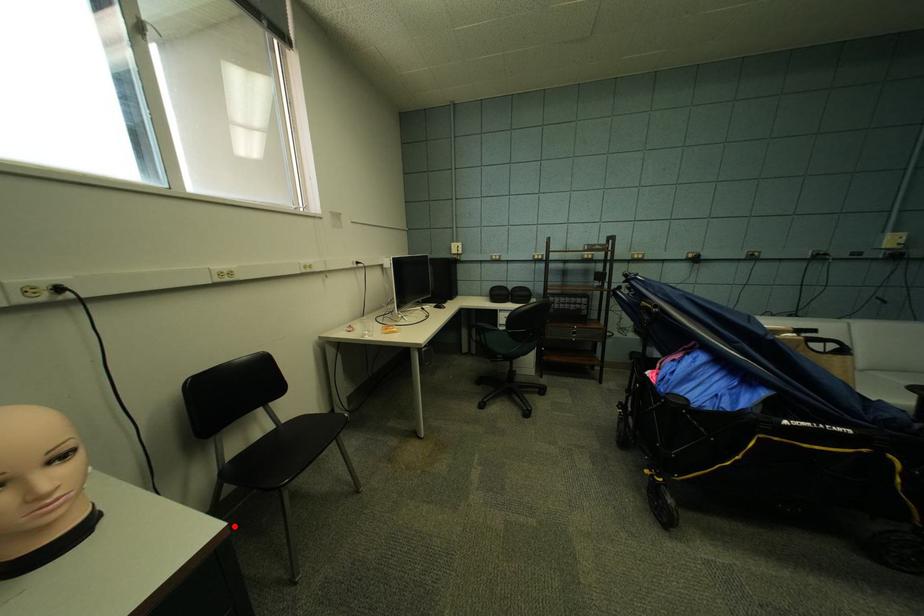
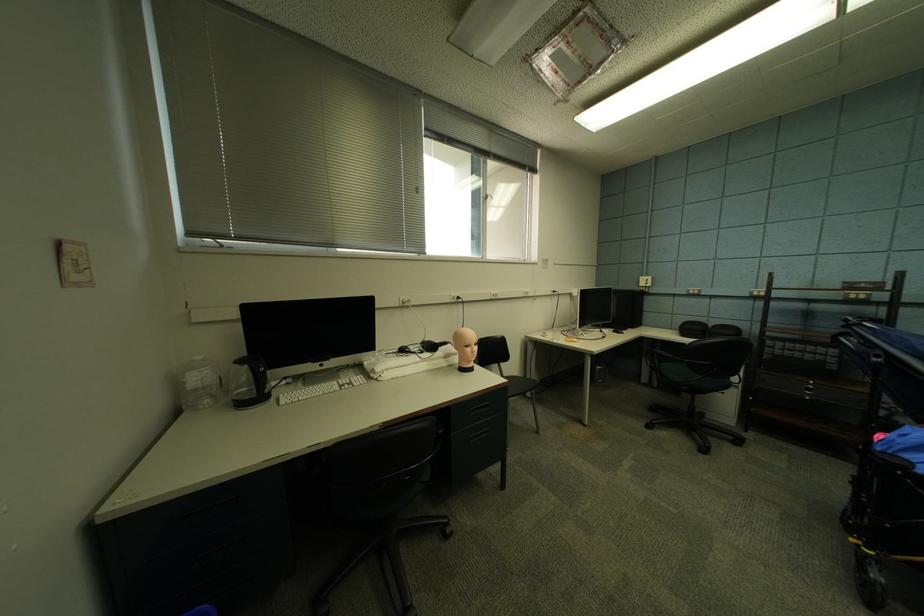
Find the pixel in the second image that matches the highlighted location in the first image.

(517, 382)